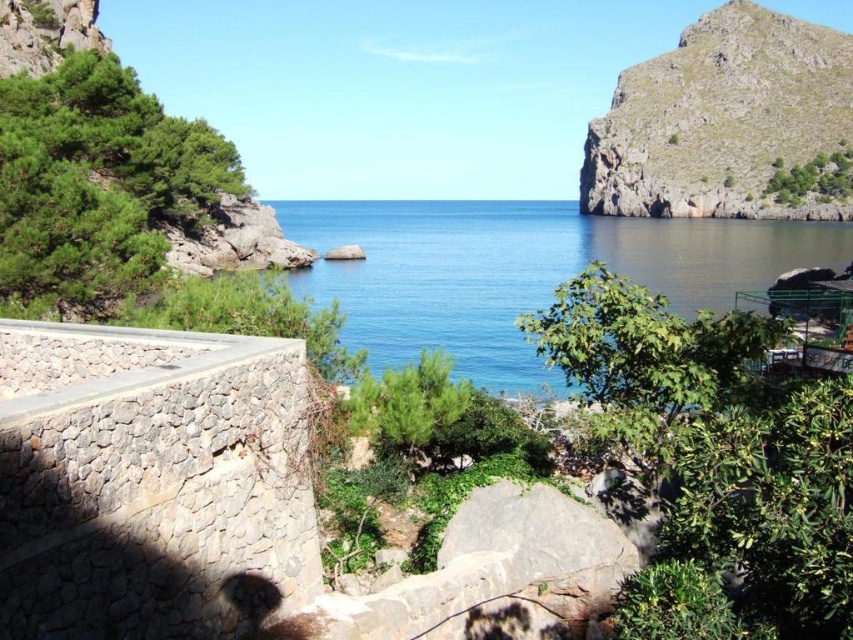
Question: Is blue water at center bigger than rugged rock cliff at upper right?

Choices:
 (A) no
 (B) yes

Answer: (B)

Question: Which point is farther to the camera?

Choices:
 (A) rugged rock cliff at upper right
 (B) smooth gray rock at center

Answer: (A)

Question: Which point is closer to the camera?

Choices:
 (A) blue water at center
 (B) smooth gray rock at center

Answer: (A)

Question: Which of these objects is positioned closest to the smooth gray rock at center?

Choices:
 (A) rugged rock cliff at upper right
 (B) blue water at center

Answer: (B)

Question: Is blue water at center in front of smooth gray rock at center?

Choices:
 (A) no
 (B) yes

Answer: (B)

Question: Is rugged rock cliff at upper right to the left of smooth gray rock at center from the viewer's perspective?

Choices:
 (A) yes
 (B) no

Answer: (B)